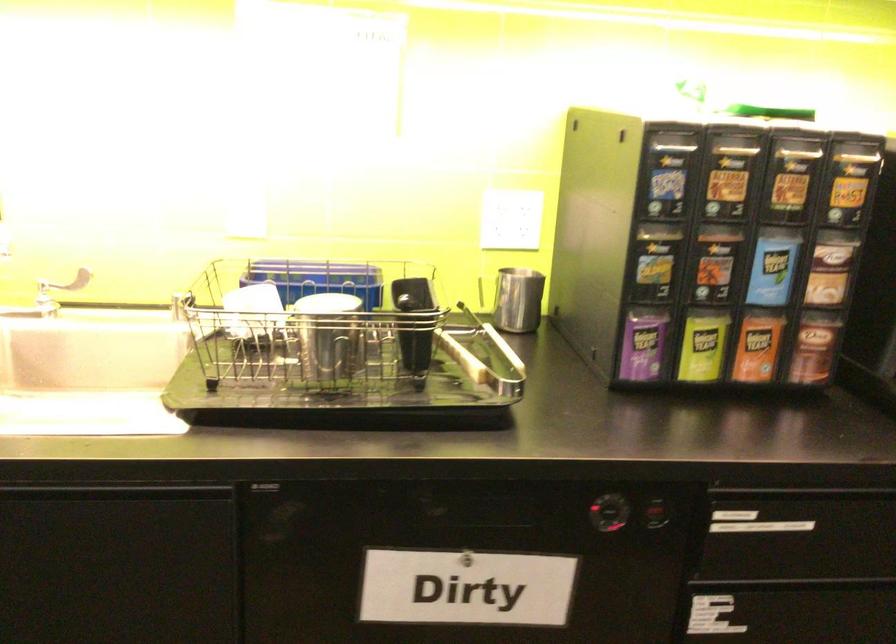
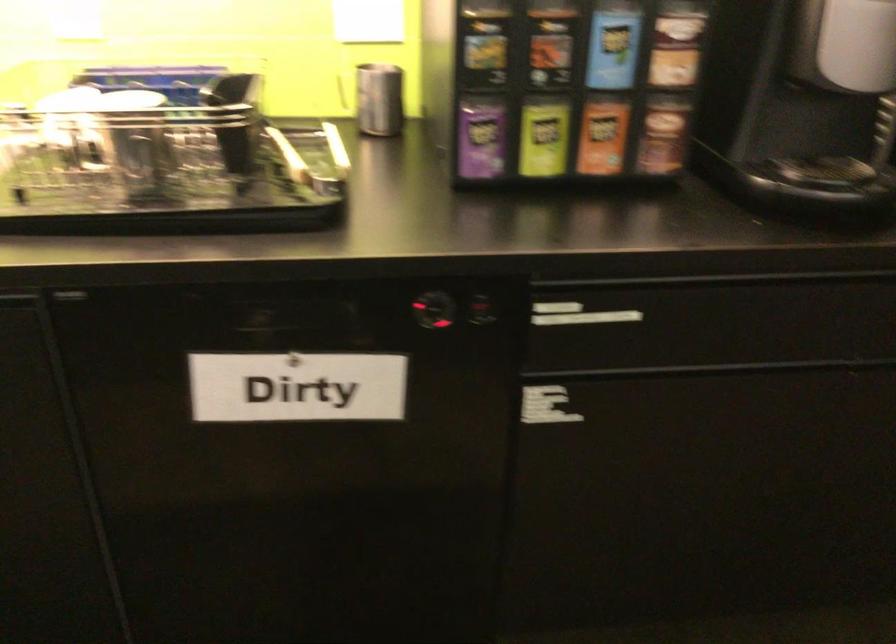
Find the pixel in the second image that matches pixel 772 265 in the first image.

(613, 44)